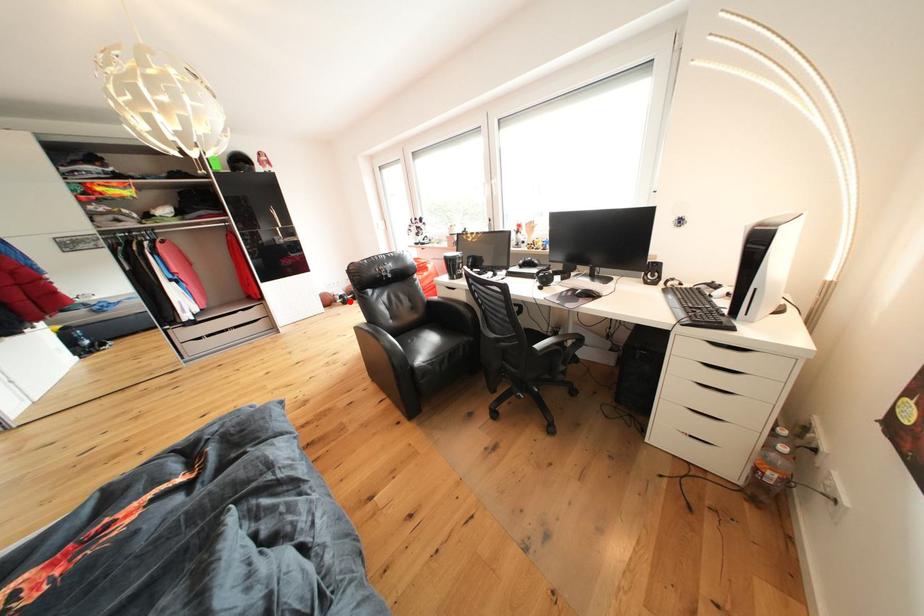
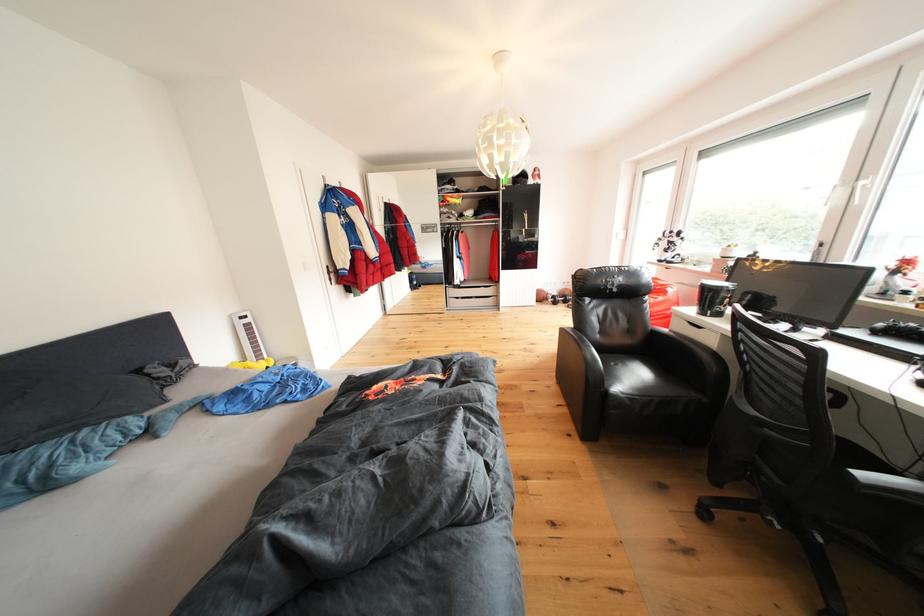
In the second image, find the point that corresponds to the highlighted location in the first image.

(563, 302)